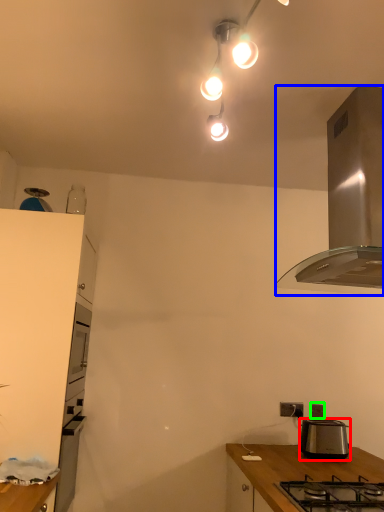
Question: Estimate the real-world distances between objects in this image. Which object is farther from toaster (highlighted by a red box), kitchen appliance (highlighted by a blue box) or power outlet (highlighted by a green box)?

Choices:
 (A) kitchen appliance
 (B) power outlet

Answer: (A)